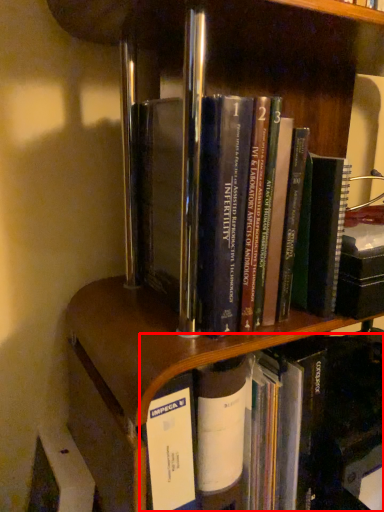
Question: From the image, what is the correct spatial relationship of book (annotated by the red box) in relation to book?

Choices:
 (A) right
 (B) left

Answer: (A)